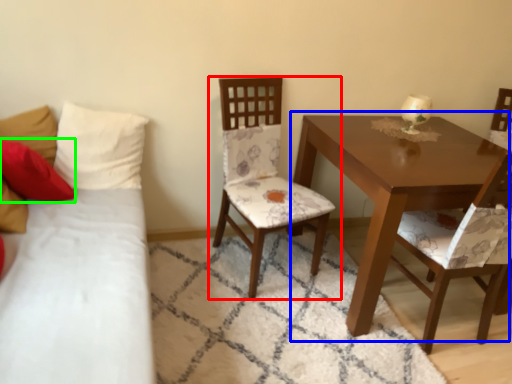
Question: Which object is positioned farthest from chair (highlighted by a red box)? Select from table (highlighted by a blue box) and pillow (highlighted by a green box).

Choices:
 (A) table
 (B) pillow

Answer: (B)